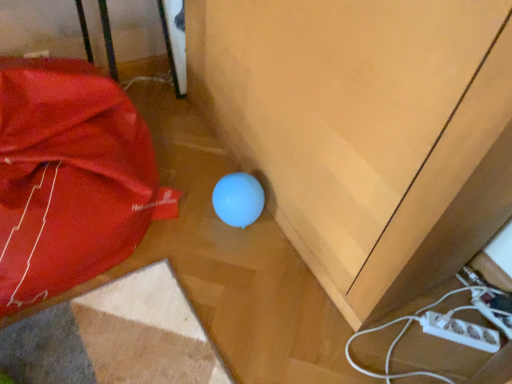
Question: Can you confirm if matte red umbrella at lower left is positioned to the right of matte wood cabinet at center?

Choices:
 (A) no
 (B) yes

Answer: (A)

Question: Does matte red umbrella at lower left have a lesser height compared to matte wood cabinet at center?

Choices:
 (A) yes
 (B) no

Answer: (A)

Question: Is matte red umbrella at lower left thinner than matte wood cabinet at center?

Choices:
 (A) no
 (B) yes

Answer: (A)

Question: Could matte wood cabinet at center be considered to be inside matte red umbrella at lower left?

Choices:
 (A) no
 (B) yes

Answer: (A)

Question: Is matte red umbrella at lower left bigger than matte wood cabinet at center?

Choices:
 (A) yes
 (B) no

Answer: (B)

Question: From the image's perspective, would you say matte red umbrella at lower left is shown under matte wood cabinet at center?

Choices:
 (A) no
 (B) yes

Answer: (B)

Question: Can matte red umbrella at lower left be found inside matte wood cabinet at center?

Choices:
 (A) yes
 (B) no

Answer: (B)

Question: Would you say matte wood cabinet at center is a long distance from matte red umbrella at lower left?

Choices:
 (A) no
 (B) yes

Answer: (A)

Question: Is matte wood cabinet at center taller than matte red umbrella at lower left?

Choices:
 (A) yes
 (B) no

Answer: (A)

Question: Is matte wood cabinet at center shorter than matte red umbrella at lower left?

Choices:
 (A) yes
 (B) no

Answer: (B)

Question: Considering the relative positions of matte wood cabinet at center and matte red umbrella at lower left in the image provided, is matte wood cabinet at center to the right of matte red umbrella at lower left from the viewer's perspective?

Choices:
 (A) no
 (B) yes

Answer: (B)

Question: Does matte wood cabinet at center turn towards matte red umbrella at lower left?

Choices:
 (A) yes
 (B) no

Answer: (A)

Question: Is matte wood cabinet at center inside the boundaries of matte red umbrella at lower left, or outside?

Choices:
 (A) outside
 (B) inside

Answer: (A)